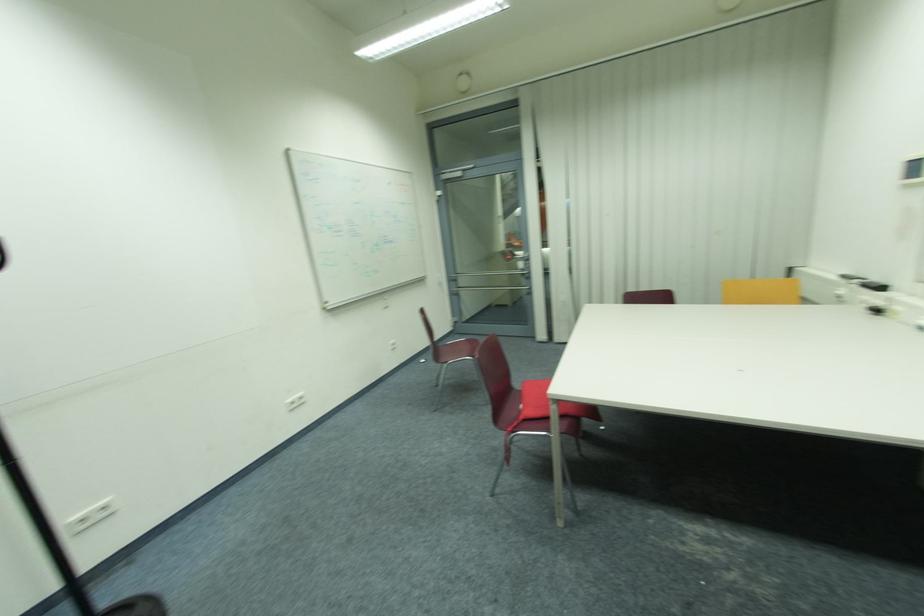
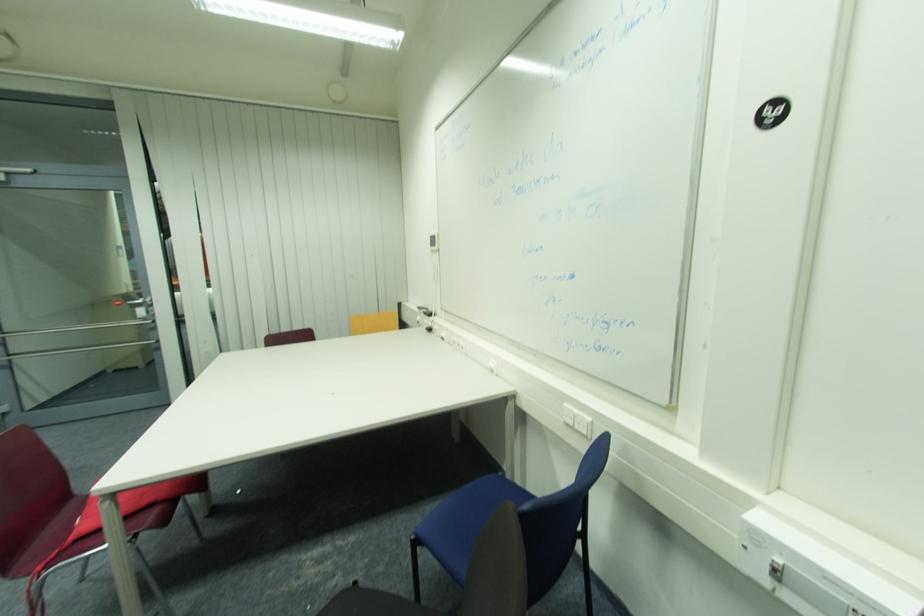
Question: How did the camera likely rotate?

Choices:
 (A) Left
 (B) Right
 (C) Up
 (D) Down

Answer: (B)